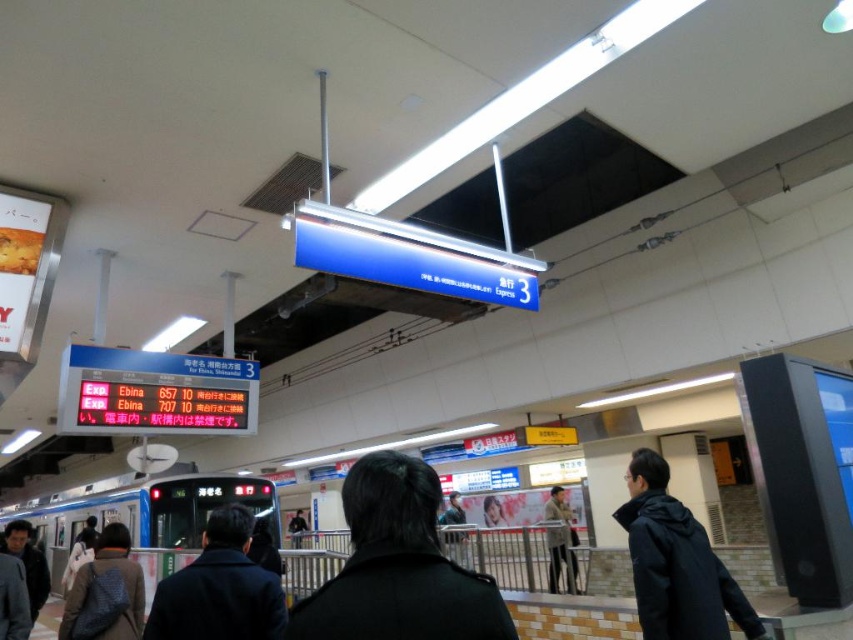
Is black coat at center below dark gray jacket at lower right?

Actually, black coat at center is above dark gray jacket at lower right.

Does black coat at center have a smaller size compared to dark gray jacket at lower right?

Yes.

Image resolution: width=853 pixels, height=640 pixels. I want to click on black coat at center, so click(398, 566).

Can you confirm if dark blue coat at center is shorter than dark brown leather jacket at lower left?

Correct, dark blue coat at center is not as tall as dark brown leather jacket at lower left.

Is the position of dark blue coat at center more distant than that of dark brown leather jacket at lower left?

No, it is in front of dark brown leather jacket at lower left.

The image size is (853, 640). Identify the location of dark blue coat at center. (219, 588).

Identify the location of dark blue coat at center. The image size is (853, 640). (219, 588).

Does dark gray jacket at lower right have a greater height compared to dark brown leather jacket at lower left?

Yes.

What do you see at coordinates (676, 563) in the screenshot?
I see `dark gray jacket at lower right` at bounding box center [676, 563].

Describe the element at coordinates (676, 563) in the screenshot. I see `dark gray jacket at lower right` at that location.

Identify the location of dark gray jacket at lower right. (676, 563).